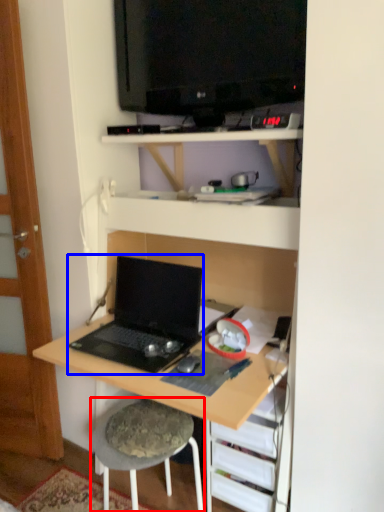
Question: Among these objects, which one is nearest to the camera, stool (highlighted by a red box) or laptop (highlighted by a blue box)?

Choices:
 (A) stool
 (B) laptop

Answer: (B)